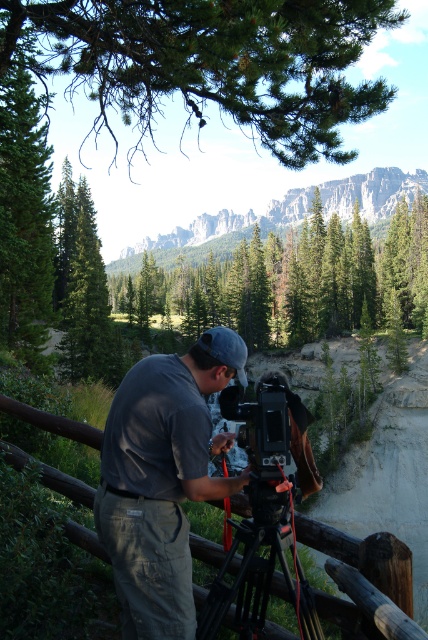
Is point (165, 548) less distant than point (243, 428)?

Yes, point (165, 548) is in front of point (243, 428).

Who is lower down, gray cotton shirt at center or black matte camera at center?

black matte camera at center is below.

The height and width of the screenshot is (640, 428). Find the location of `gray cotton shirt at center`. gray cotton shirt at center is located at coordinates (162, 480).

Is point (363, 576) less distant than point (300, 428)?

Yes.

Does brown wooden fence at lower center have a lesser height compared to black matte camera at center?

Yes, brown wooden fence at lower center is shorter than black matte camera at center.

Between point (15, 404) and point (246, 426), which one is positioned in front?

Positioned in front is point (246, 426).

Where is `brown wooden fence at lower center`? brown wooden fence at lower center is located at coordinates (360, 554).

Which is more to the right, black matte tripod at center or brown wooden fence at lower center?

Positioned to the right is black matte tripod at center.

Who is higher up, black matte tripod at center or brown wooden fence at lower center?

brown wooden fence at lower center

Is point (253, 529) positioned behind point (380, 563)?

That is True.

Identify the location of black matte tripod at center. (261, 568).